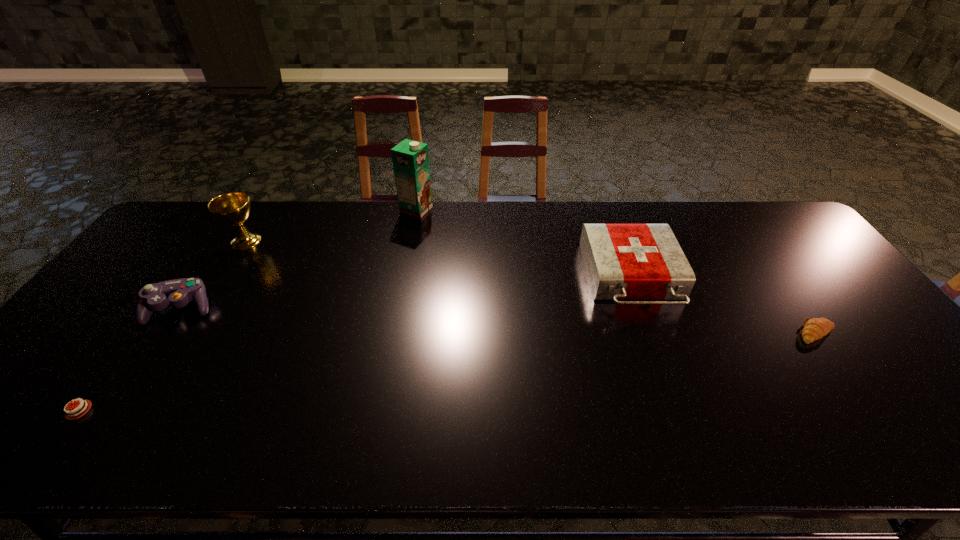
Locate an element on the screen. The height and width of the screenshot is (540, 960). vacant area located on the right of the chalice is located at coordinates (282, 241).

This screenshot has width=960, height=540. Find the location of `free space located 0.260m on the front side of the second object from right to left`. free space located 0.260m on the front side of the second object from right to left is located at coordinates (679, 407).

This screenshot has height=540, width=960. I want to click on free point located on the front of the control, so click(x=132, y=382).

At what (x,y) coordinates should I click in order to perform the action: click on free space located 0.160m on the back of the rightmost object. Please return your answer as a coordinate pair (x, y). The height and width of the screenshot is (540, 960). Looking at the image, I should click on (780, 281).

Find the location of `vacant space situated on the back of the shortest object`. vacant space situated on the back of the shortest object is located at coordinates (177, 278).

Find the location of a particular element. The height and width of the screenshot is (540, 960). carton situated at the far edge is located at coordinates (410, 158).

Image resolution: width=960 pixels, height=540 pixels. I want to click on chalice that is at the far edge, so click(x=233, y=208).

Find the location of a particular element. the first-aid kit that is at the far edge is located at coordinates (623, 261).

The height and width of the screenshot is (540, 960). What are the coordinates of `object that is positioned at the near edge` in the screenshot? It's located at (70, 415).

The height and width of the screenshot is (540, 960). I want to click on control at the left edge, so click(153, 297).